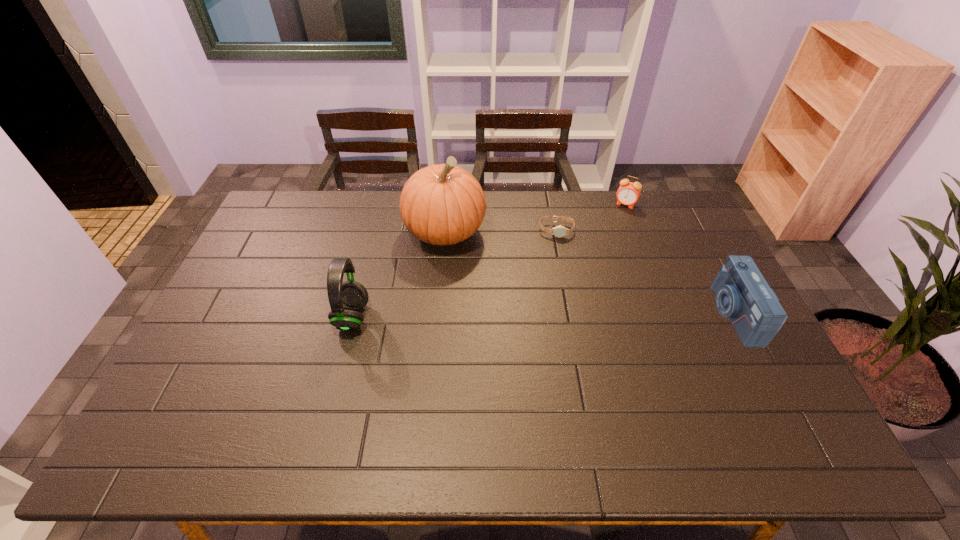
Locate an element on the screen. This screenshot has height=540, width=960. free space at the left edge is located at coordinates point(292,257).

Find the location of a particular element. The width and height of the screenshot is (960, 540). free space at the right edge of the desktop is located at coordinates (703, 233).

Identify the location of vacant space at the near right corner. (775, 398).

You are a GUI agent. You are given a task and a screenshot of the screen. Output one action in this format:
    pyautogui.click(x=<x>, y=<y>)
    Task: Click on the empty location between the leftmost object and the fourth object from right to left
    The height and width of the screenshot is (540, 960).
    Given the screenshot: What is the action you would take?
    (x=398, y=274)

The height and width of the screenshot is (540, 960). I want to click on unoccupied position between the shortest object and the headset, so click(x=454, y=273).

This screenshot has width=960, height=540. I want to click on vacant region between the second shortest object and the headset, so click(489, 261).

Find the location of a particular element. The width and height of the screenshot is (960, 540). free space between the shortest object and the fourth object from right to left is located at coordinates (500, 231).

Identify the location of free space between the leftmost object and the tallest object. The width and height of the screenshot is (960, 540). (398, 274).

Where is `free space between the leftmost object and the second object from right to left`? The image size is (960, 540). free space between the leftmost object and the second object from right to left is located at coordinates (489, 261).

I want to click on vacant region between the second tallest object and the second object from left to right, so click(398, 274).